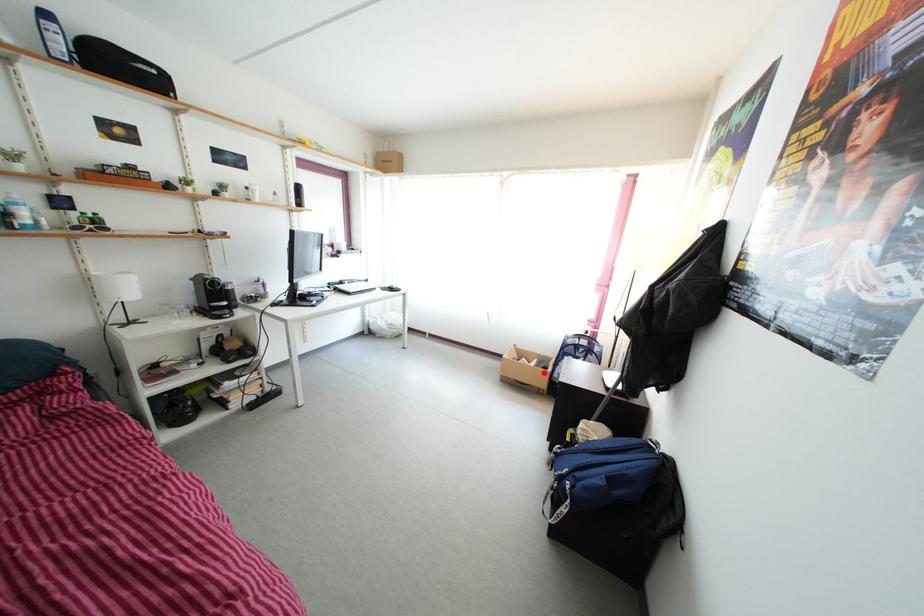
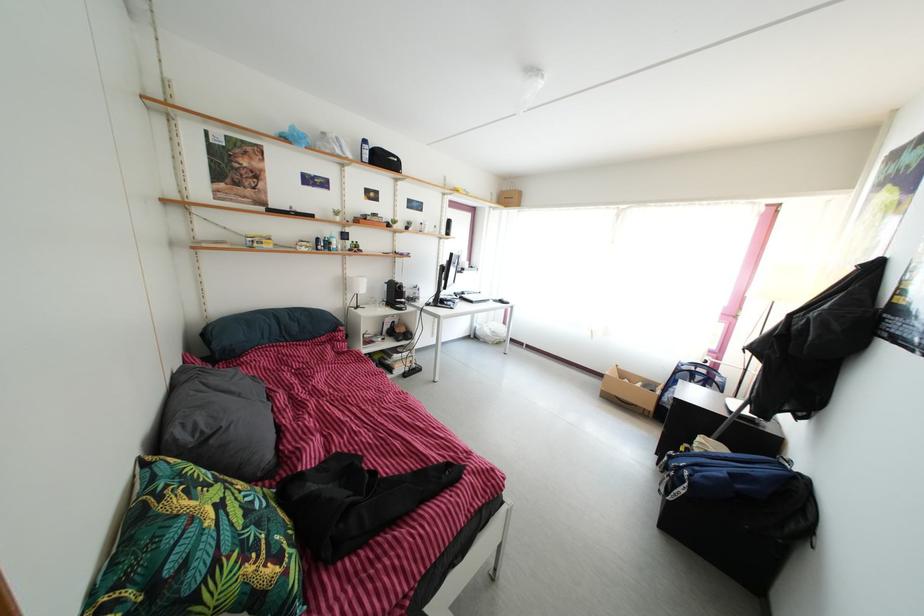
The point at the highlighted location is marked in the first image. Where is the corresponding point in the second image?

(650, 394)